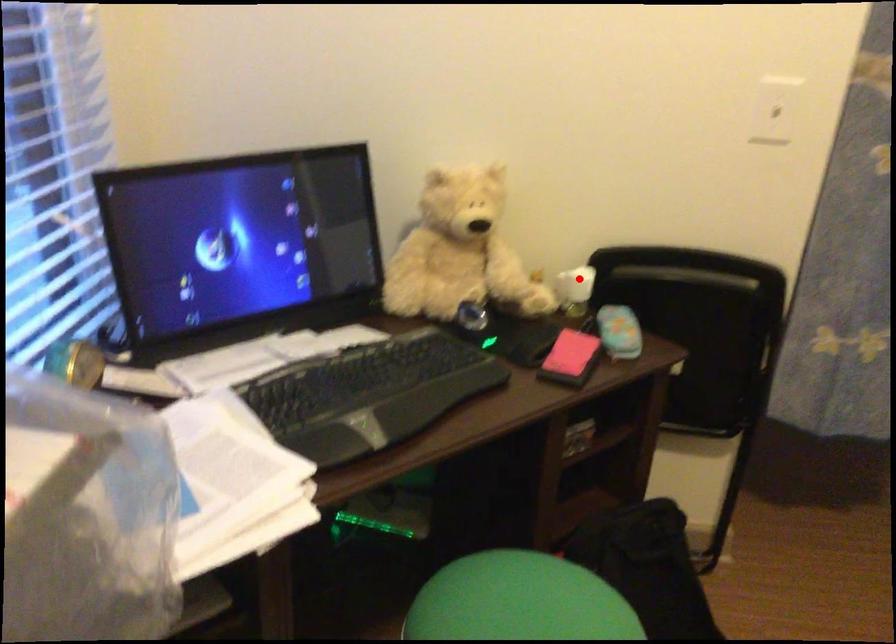
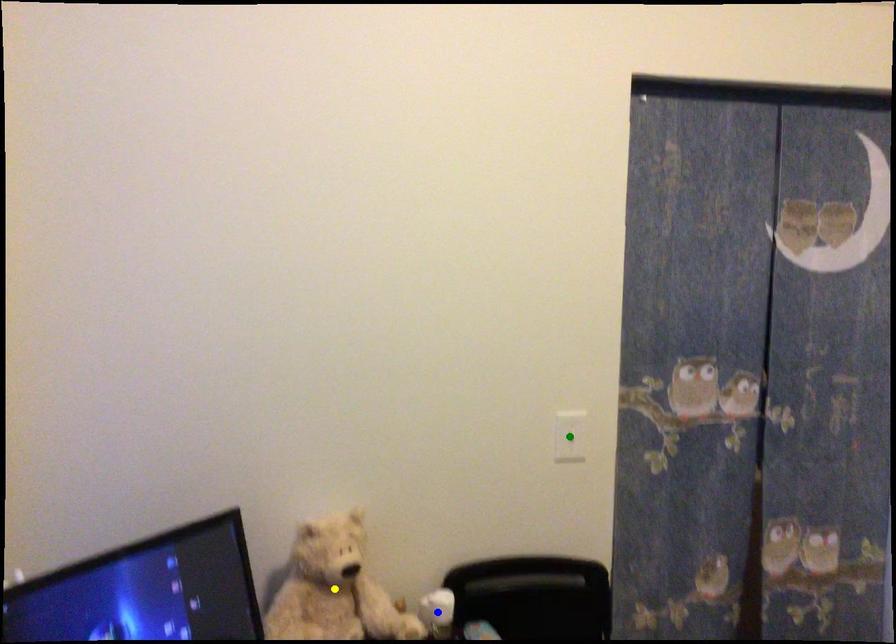
Question: I am providing you with two images of the same scene from different viewpoints. A red point is marked on the first image. You are given multiple points on the second image. Can you choose the point in image 2 that corresponds to the point in image 1?

Choices:
 (A) yellow point
 (B) blue point
 (C) green point

Answer: (B)